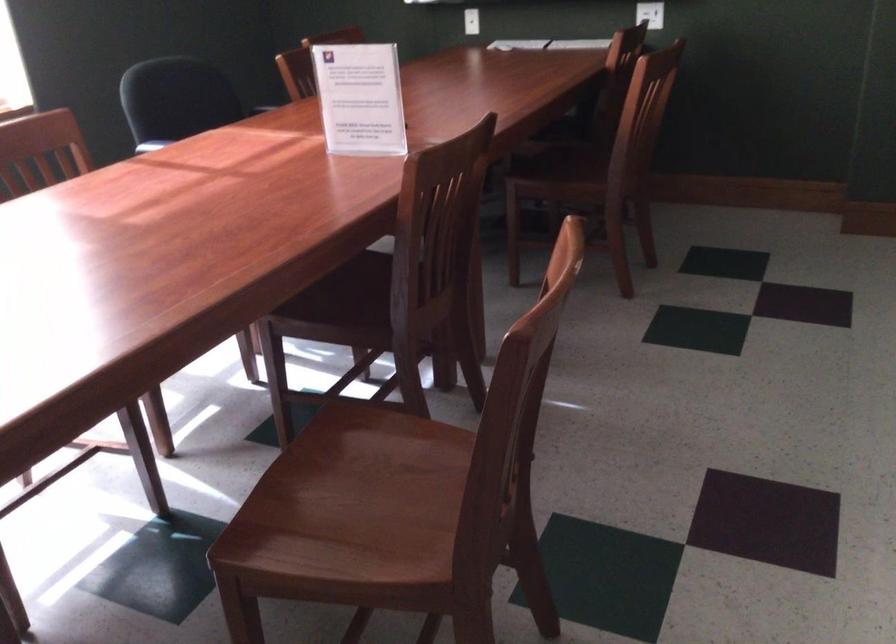
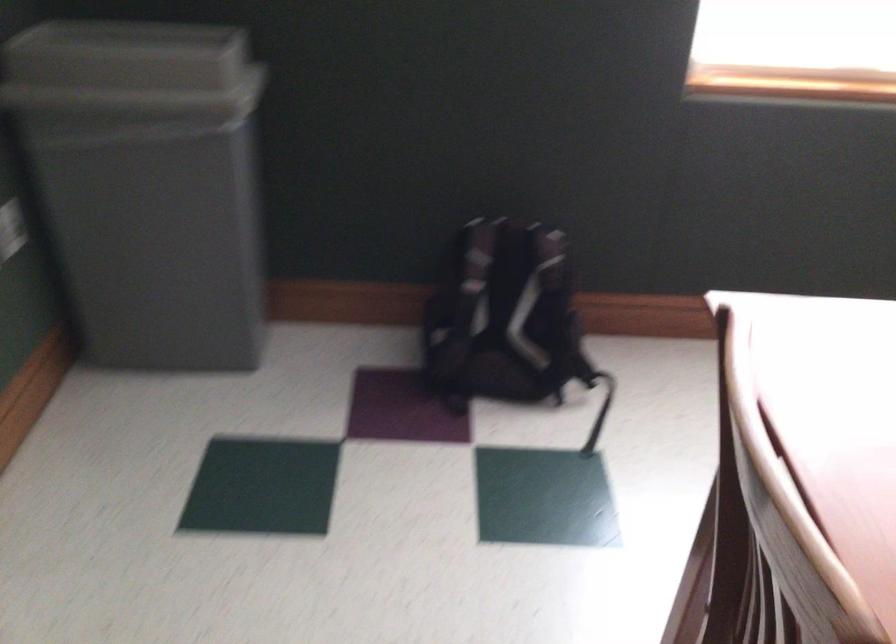
Based on the continuous images, in which direction is the camera rotating?

The rotation direction of the camera is left-down.